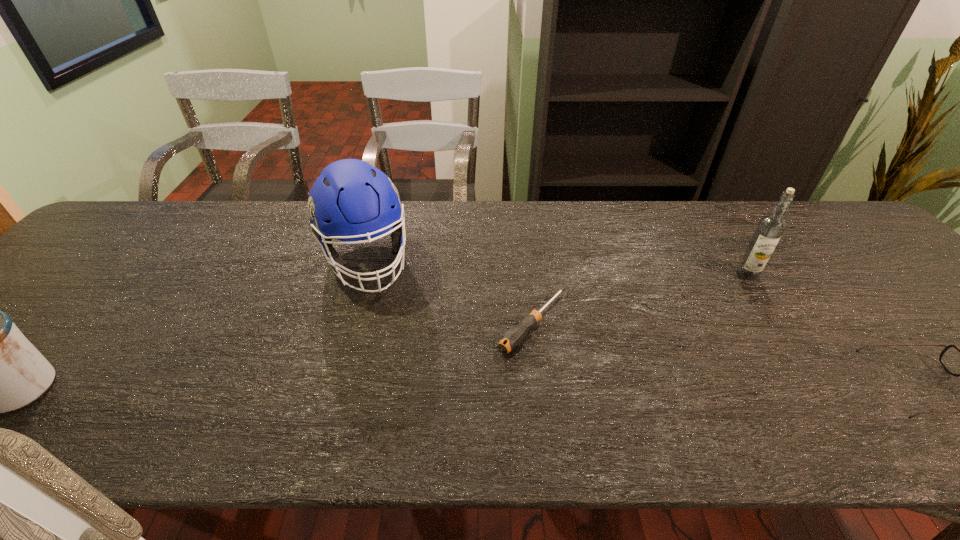
In order to click on blank region between the second object from left to right and the vodka in this screenshot , I will do `click(556, 267)`.

You are a GUI agent. You are given a task and a screenshot of the screen. Output one action in this format:
    pyautogui.click(x=<x>, y=<y>)
    Task: Click on the object that is the fourth closest to the sunglasses
    This screenshot has height=540, width=960.
    Given the screenshot: What is the action you would take?
    pyautogui.click(x=0, y=371)

Identify the location of object that is the closest to the football helmet. This screenshot has width=960, height=540. (514, 336).